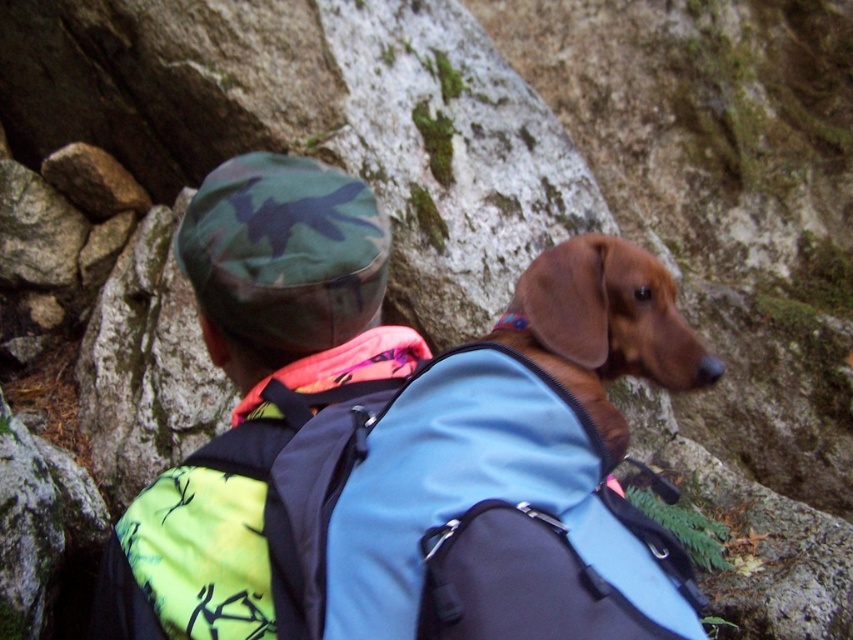
You are a hiker who wants to take a photo of the brown smooth dog at center and the camo fabric hat at upper center. Which object should you focus on first to ensure both are in clear view?

You should focus on the camo fabric hat at upper center first because it is closer to you than the brown smooth dog at center, so adjusting focus from near to far will help both be in clear view.